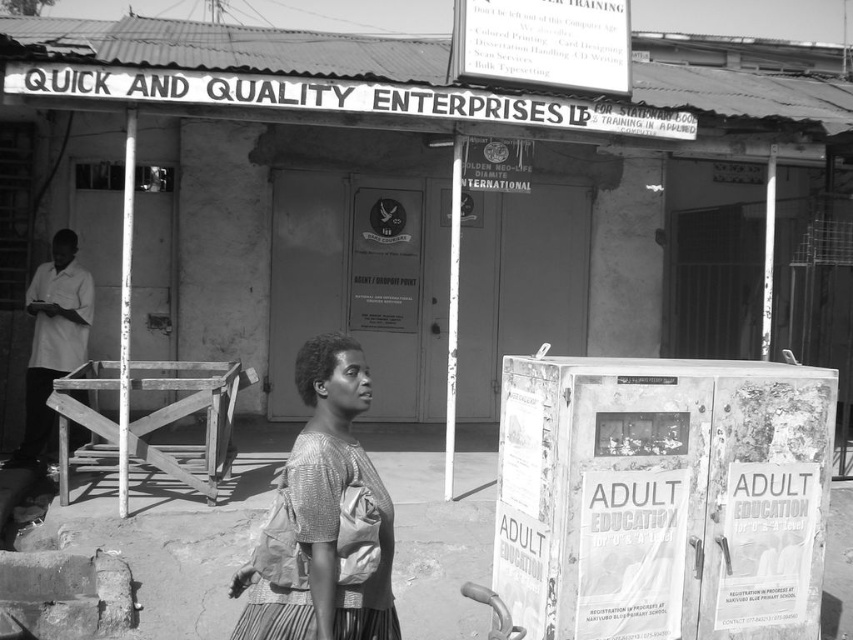
Consider the image. Does white cardboard bulletin board at lower right have a greater width compared to knitted fabric dress at center?

Correct, the width of white cardboard bulletin board at lower right exceeds that of knitted fabric dress at center.

Between point (631, 486) and point (347, 410), which one is positioned in front?

Point (347, 410) is more forward.

The height and width of the screenshot is (640, 853). I want to click on white cardboard bulletin board at lower right, so click(662, 497).

Between white cardboard bulletin board at lower right and white shirt at left, which one is positioned higher?

white shirt at left is higher up.

Is point (595, 506) closer to camera compared to point (25, 449)?

Yes, point (595, 506) is in front of point (25, 449).

Identify the location of white cardboard bulletin board at lower right. The image size is (853, 640). (662, 497).

Can you confirm if knitted fabric dress at center is positioned to the right of white paper sign at upper center?

Incorrect, knitted fabric dress at center is not on the right side of white paper sign at upper center.

Which is in front, point (299, 563) or point (491, 36)?

Point (299, 563) is in front.

Does point (328, 522) come behind point (583, 72)?

No, (328, 522) is closer to viewer.

You are a GUI agent. You are given a task and a screenshot of the screen. Output one action in this format:
    pyautogui.click(x=<x>, y=<y>)
    Task: Click on the knitted fabric dress at center
    Image resolution: width=853 pixels, height=640 pixels.
    Given the screenshot: What is the action you would take?
    pyautogui.click(x=323, y=518)